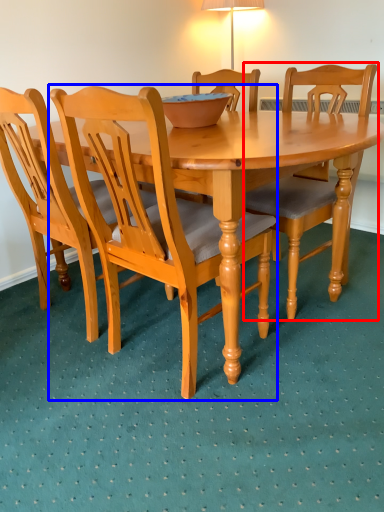
Question: Which object appears farthest to the camera in this image, chair (highlighted by a red box) or chair (highlighted by a blue box)?

Choices:
 (A) chair
 (B) chair

Answer: (A)